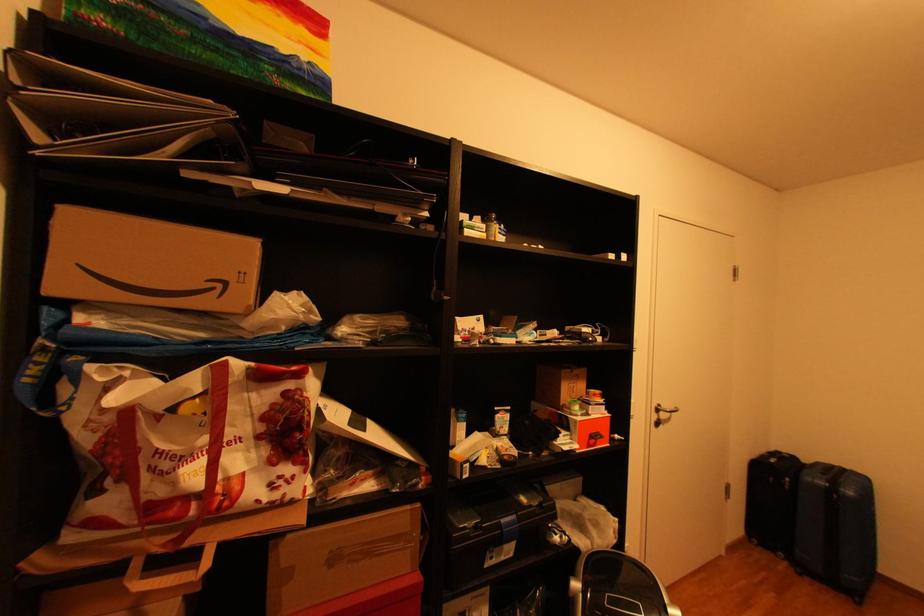
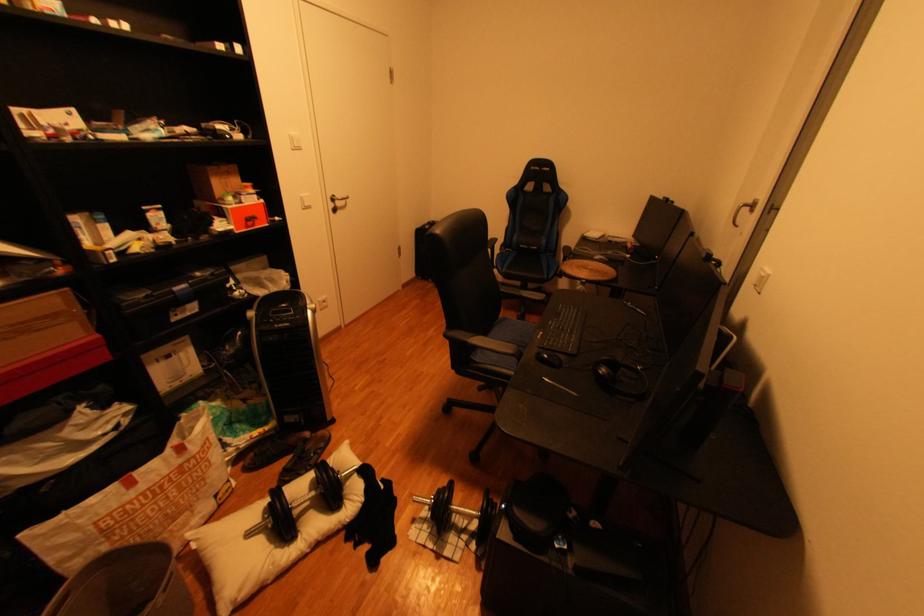
In the second image, find the point that corresponds to [581,386] in the first image.

(235, 182)